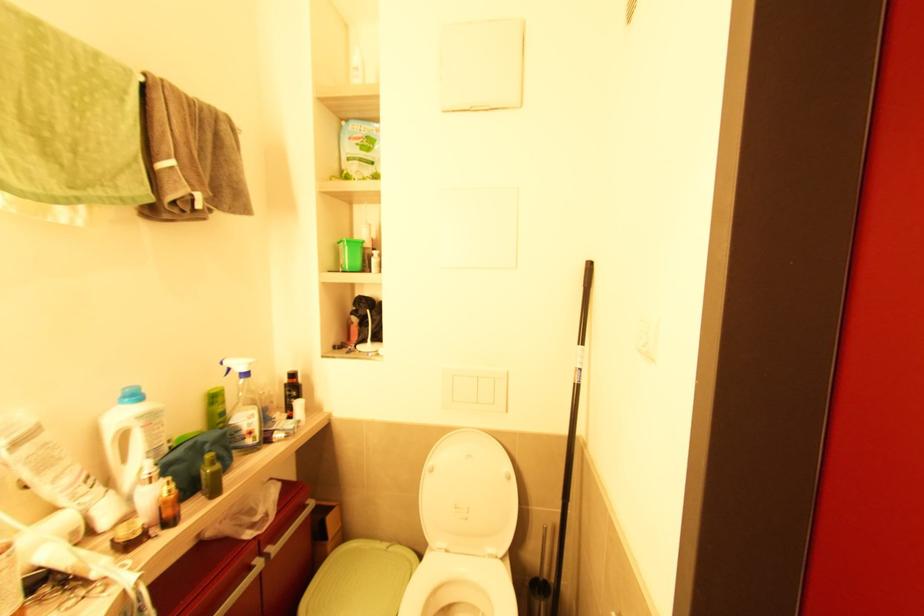
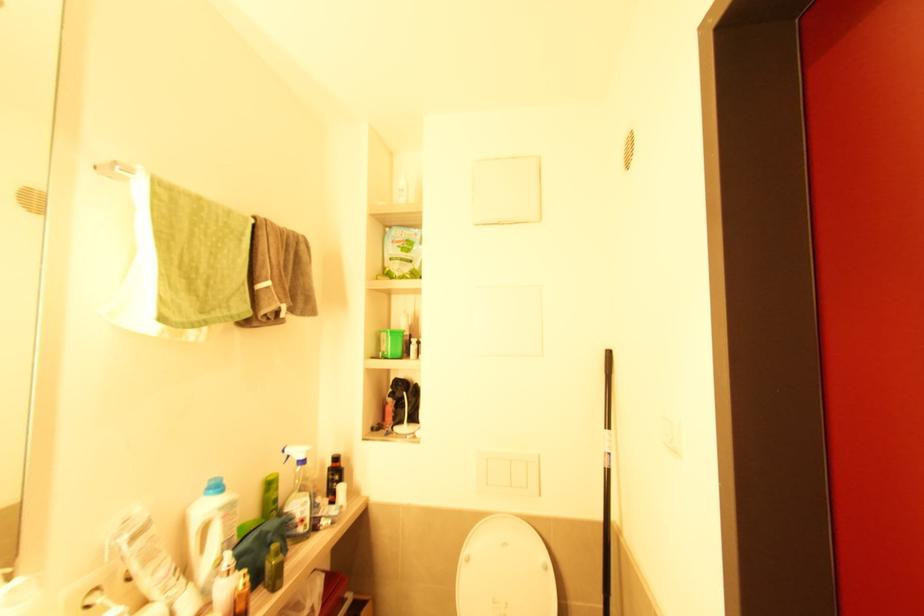
Locate, in the second image, the point that corresponds to the point at 249,375 in the first image.

(305, 462)